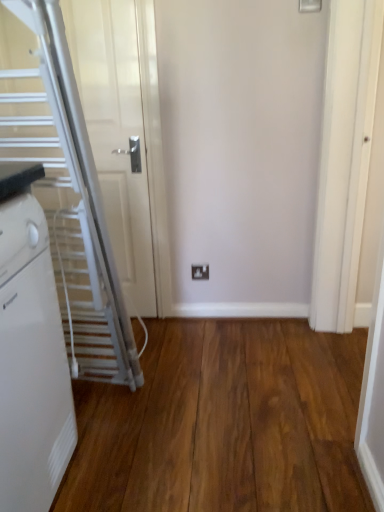
Question: Based on their positions, is white plastic radiator at left located to the left or right of white plastic electric outlet at center?

Choices:
 (A) left
 (B) right

Answer: (A)

Question: Considering the positions of white plastic radiator at left and white plastic electric outlet at center in the image, is white plastic radiator at left bigger or smaller than white plastic electric outlet at center?

Choices:
 (A) small
 (B) big

Answer: (B)

Question: Which object is the closest to the white plastic electric outlet at center?

Choices:
 (A) white metallic escalator at left
 (B) white plastic radiator at left
 (C) brown wood flooring at center

Answer: (C)

Question: Estimate the real-world distances between objects in this image. Which object is closer to the white metallic escalator at left?

Choices:
 (A) white plastic radiator at left
 (B) white plastic electric outlet at center
 (C) brown wood flooring at center

Answer: (A)